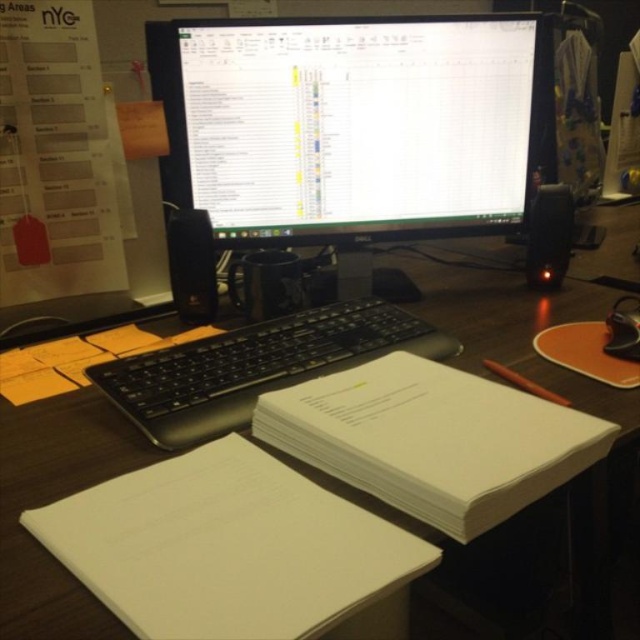
You are organizing the desk and want to place a new mousepad between the white glossy monitor at center and the black plastic keyboard at center. Based on their positions, which object should the mousepad be placed to the left of?

The mousepad should be placed to the left of the black plastic keyboard at center because the white glossy monitor at center is to the right of the black plastic keyboard at center.

You are a delivery person who needs to place a box on the desk without touching the white glossy monitor at center. The box is 36 inches long. Can you place it horizontally on the desk?

The distance between the white glossy monitor at center and the camera is 36.15 inches. Since the box is 36 inches long, it can be placed horizontally on the desk without touching the monitor as there is enough space.